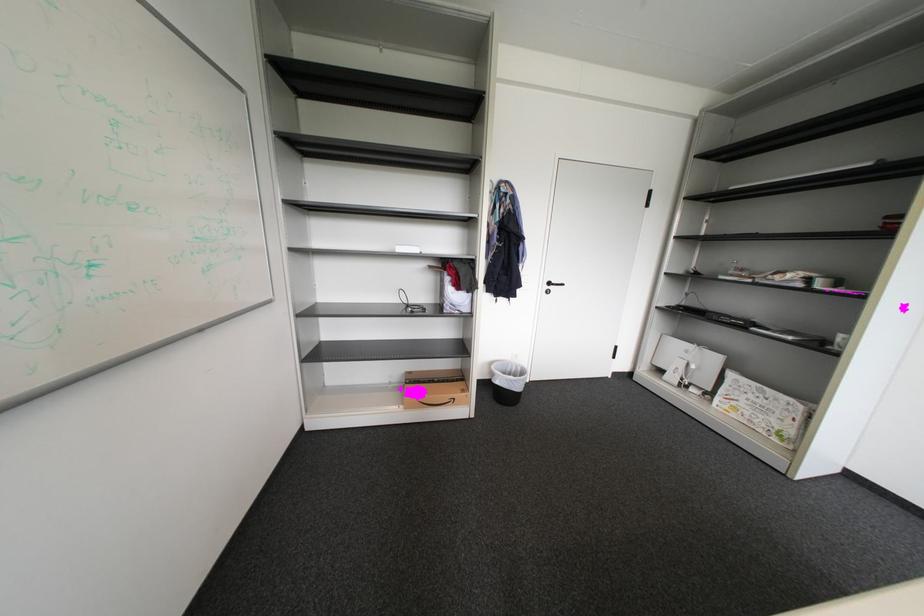
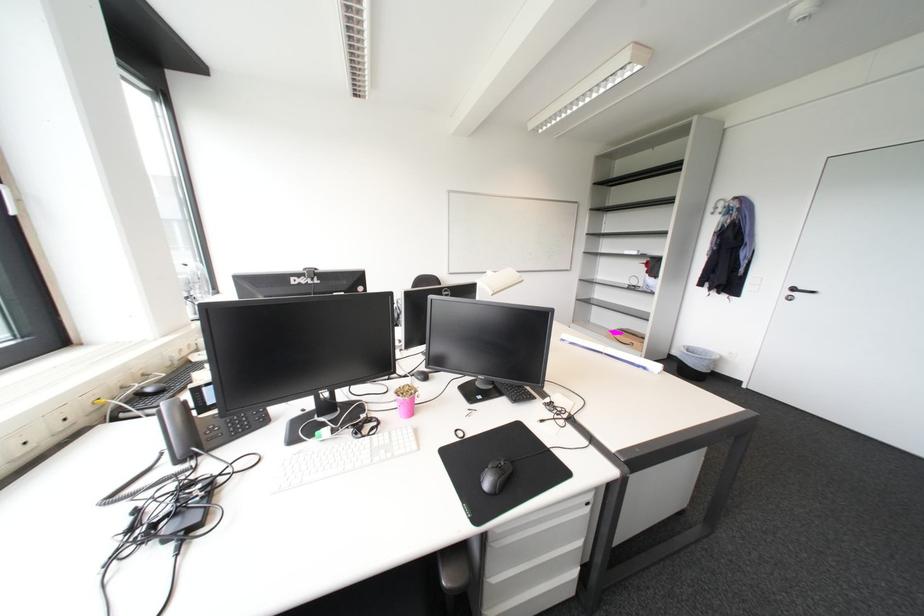
Find the pixel in the second image that matches pixel 560 285 in the first image.

(805, 291)